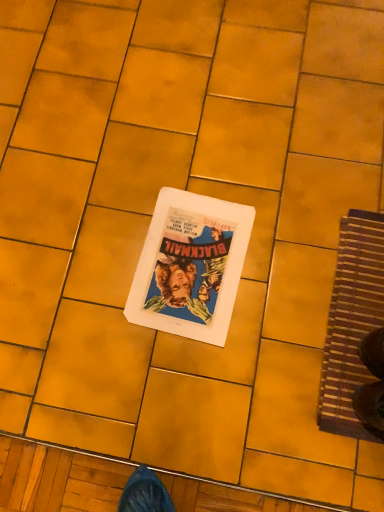
What do you see at coordinates (190, 266) in the screenshot?
I see `white paper at center` at bounding box center [190, 266].

The width and height of the screenshot is (384, 512). Identify the location of white paper at center. (190, 266).

Describe the element at coordinates (352, 324) in the screenshot. I see `brown woven mat at right` at that location.

This screenshot has height=512, width=384. In order to click on brown woven mat at right in this screenshot , I will do `click(352, 324)`.

Where is `white paper at center`? The height and width of the screenshot is (512, 384). white paper at center is located at coordinates (190, 266).

Considering the positions of objects white paper at center and brown woven mat at right in the image provided, who is more to the right, white paper at center or brown woven mat at right?

From the viewer's perspective, brown woven mat at right appears more on the right side.

Which object is closer to the camera, white paper at center or brown woven mat at right?

brown woven mat at right is closer to the camera.

Which is nearer, (197, 221) or (342, 379)?

The point (342, 379) is closer.

From the image's perspective, is white paper at center beneath brown woven mat at right?

Actually, white paper at center appears above brown woven mat at right in the image.

From a real-world perspective, is white paper at center positioned over brown woven mat at right based on gravity?

Yes, from a real-world perspective, white paper at center is above brown woven mat at right.

Considering the sizes of white paper at center and brown woven mat at right in the image, is white paper at center wider or thinner than brown woven mat at right?

In the image, white paper at center appears to be more narrow than brown woven mat at right.

Considering the relative sizes of white paper at center and brown woven mat at right in the image provided, is white paper at center taller than brown woven mat at right?

In fact, white paper at center may be shorter than brown woven mat at right.

Which of these two, white paper at center or brown woven mat at right, is bigger?

brown woven mat at right is bigger.

Is white paper at center inside the boundaries of brown woven mat at right, or outside?

white paper at center is outside brown woven mat at right.

Is white paper at center beside brown woven mat at right?

No, white paper at center is not next to brown woven mat at right.

Could you tell me if white paper at center is facing brown woven mat at right?

No, white paper at center does not turn towards brown woven mat at right.

In the scene shown: How different are the orientations of white paper at center and brown woven mat at right in degrees?

white paper at center and brown woven mat at right are facing 5.59 degrees away from each other.

I want to click on doormat below the white paper at center (from a real-world perspective), so click(x=352, y=324).

Can you confirm if brown woven mat at right is positioned to the right of white paper at center?

Indeed, brown woven mat at right is positioned on the right side of white paper at center.

Between brown woven mat at right and white paper at center, which one is positioned behind?

white paper at center is further from the camera.

Does point (377, 304) come behind point (176, 270)?

No.

From the image's perspective, between brown woven mat at right and white paper at center, which one is located above?

From the image's view, white paper at center is above.

From a real-world perspective, is brown woven mat at right positioned above or below white paper at center?

In terms of real-world spatial position, brown woven mat at right is below white paper at center.

Based on the photo, is brown woven mat at right wider or thinner than white paper at center?

brown woven mat at right is wider than white paper at center.

Is brown woven mat at right taller or shorter than white paper at center?

Considering their sizes, brown woven mat at right has more height than white paper at center.

In terms of size, does brown woven mat at right appear bigger or smaller than white paper at center?

Considering their sizes, brown woven mat at right takes up more space than white paper at center.

Is brown woven mat at right not inside white paper at center?

Yes, brown woven mat at right is located beyond the bounds of white paper at center.

Is brown woven mat at right not near white paper at center?

No, brown woven mat at right is not far from white paper at center.

Could you tell me if brown woven mat at right is facing white paper at center?

No, brown woven mat at right does not turn towards white paper at center.

Can you tell me how much brown woven mat at right and white paper at center differ in facing direction?

They differ by 5.59 degrees in their facing directions.

I want to click on paperback book behind the brown woven mat at right, so click(190, 266).

What are the coordinates of `doormat below the white paper at center (from the image's perspective)` in the screenshot? It's located at (352, 324).

Identify the location of doormat on the right of white paper at center. (352, 324).